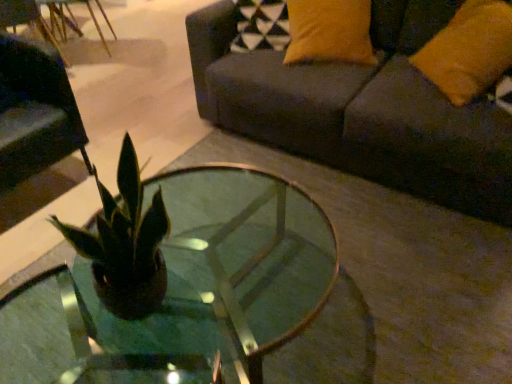
Question: Considering the relative sizes of dark gray fabric couch at upper right and orange fabric pillow at upper right in the image provided, is dark gray fabric couch at upper right smaller than orange fabric pillow at upper right?

Choices:
 (A) no
 (B) yes

Answer: (A)

Question: Is dark gray fabric couch at upper right at the right side of orange fabric pillow at upper right?

Choices:
 (A) yes
 (B) no

Answer: (B)

Question: Does dark gray fabric couch at upper right have a lesser height compared to orange fabric pillow at upper right?

Choices:
 (A) yes
 (B) no

Answer: (B)

Question: Is dark gray fabric couch at upper right further to the viewer compared to orange fabric pillow at upper right?

Choices:
 (A) yes
 (B) no

Answer: (B)

Question: From the image's perspective, does dark gray fabric couch at upper right appear lower than orange fabric pillow at upper right?

Choices:
 (A) no
 (B) yes

Answer: (A)

Question: In terms of size, does matte black swivel chair at left appear bigger or smaller than orange fabric pillow at upper right?

Choices:
 (A) small
 (B) big

Answer: (B)

Question: Is matte black swivel chair at left taller or shorter than orange fabric pillow at upper right?

Choices:
 (A) tall
 (B) short

Answer: (A)

Question: Which is correct: matte black swivel chair at left is inside orange fabric pillow at upper right, or outside of it?

Choices:
 (A) inside
 (B) outside

Answer: (B)

Question: In the image, is matte black swivel chair at left positioned in front of or behind orange fabric pillow at upper right?

Choices:
 (A) behind
 (B) front

Answer: (A)

Question: Is clear glass coffee table at center to the left or to the right of dark gray fabric couch at upper right in the image?

Choices:
 (A) left
 (B) right

Answer: (A)

Question: Is clear glass coffee table at center taller or shorter than dark gray fabric couch at upper right?

Choices:
 (A) tall
 (B) short

Answer: (B)

Question: Considering the positions of point (290, 279) and point (362, 145), is point (290, 279) closer or farther from the camera than point (362, 145)?

Choices:
 (A) farther
 (B) closer

Answer: (B)

Question: Relative to dark gray fabric couch at upper right, is clear glass coffee table at center in front or behind?

Choices:
 (A) front
 (B) behind

Answer: (A)

Question: Does point (7, 97) appear closer or farther from the camera than point (102, 306)?

Choices:
 (A) farther
 (B) closer

Answer: (A)

Question: Is matte black swivel chair at left inside or outside of clear glass coffee table at center?

Choices:
 (A) outside
 (B) inside

Answer: (A)